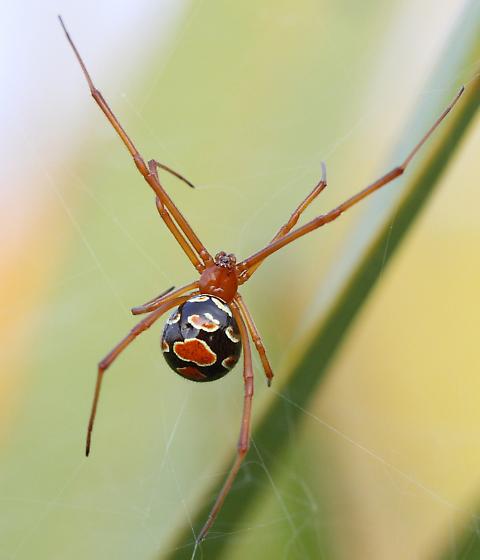
In order to click on cobweb in this screenshot , I will do `click(288, 494)`, `click(146, 473)`.